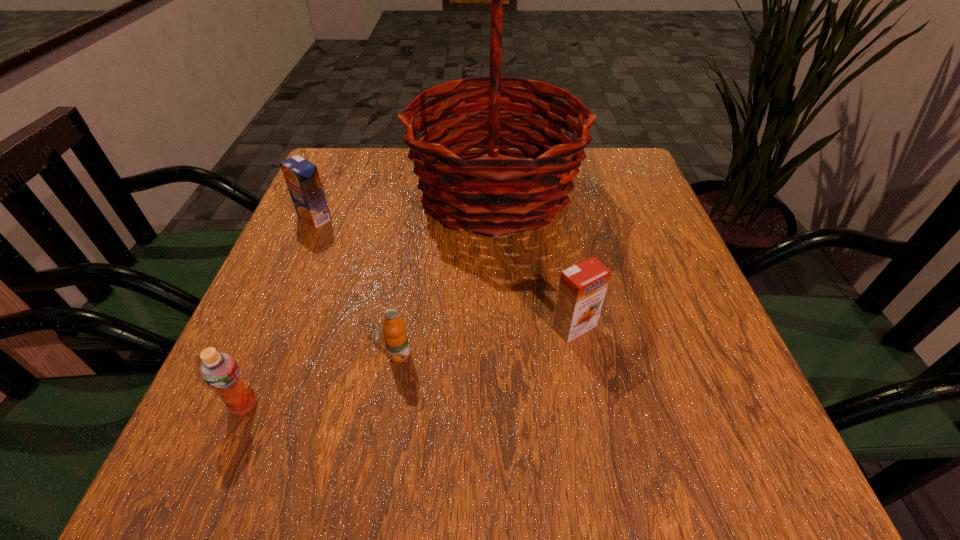
Identify the location of free point between the second farthest orange juice and the nearest object. This screenshot has height=540, width=960. (409, 365).

Identify the location of vacant space that is in between the shortest orange juice and the rightmost orange juice. (487, 341).

Identify the location of free area in between the farthest orange juice and the fourth farthest object. This screenshot has height=540, width=960. (357, 286).

Locate an element on the screen. This screenshot has height=540, width=960. unoccupied area between the third nearest object and the tallest object is located at coordinates (535, 259).

The width and height of the screenshot is (960, 540). What are the coordinates of `empty location between the rightmost orange juice and the farthest orange juice` in the screenshot? It's located at (444, 272).

Image resolution: width=960 pixels, height=540 pixels. In order to click on blank region between the second nearest object and the farthest orange juice in this screenshot , I will do `click(357, 286)`.

Locate an element on the screen. The height and width of the screenshot is (540, 960). free area in between the basket and the nearest orange juice is located at coordinates pos(370,298).

The height and width of the screenshot is (540, 960). Identify the location of empty space between the farthest orange juice and the nearest orange juice. (279, 311).

Locate an element on the screen. vacant area that lies between the third farthest orange juice and the farthest orange juice is located at coordinates 357,286.

Find the location of a particular element. The width and height of the screenshot is (960, 540). object that stands as the second closest to the second orange juice from right to left is located at coordinates (582, 287).